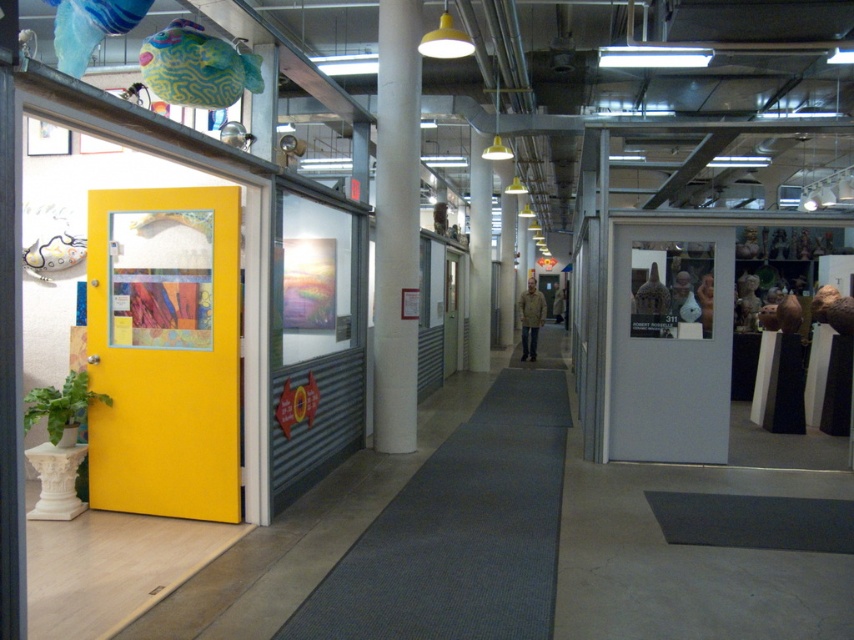
Is white smooth pillar at center bigger than tan textured jacket at center?

Yes, white smooth pillar at center is bigger than tan textured jacket at center.

Is white smooth pillar at center below tan textured jacket at center?

No, white smooth pillar at center is not below tan textured jacket at center.

Does point (384, 337) lie in front of point (531, 360)?

Yes, it is.

At what (x,y) coordinates should I click in order to perform the action: click on white smooth pillar at center. Please return your answer as a coordinate pair (x, y). Looking at the image, I should click on (396, 227).